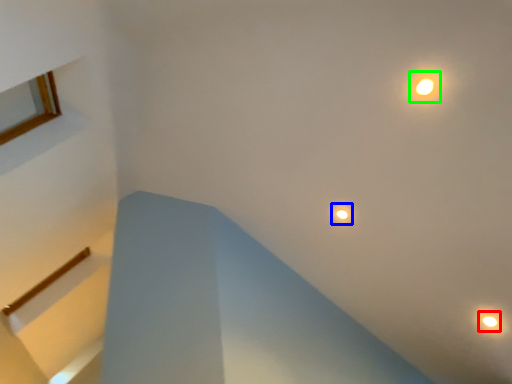
Question: Which is farther away from droplight (highlighted by a red box)? droplight (highlighted by a blue box) or light (highlighted by a green box)?

Choices:
 (A) droplight
 (B) light

Answer: (B)